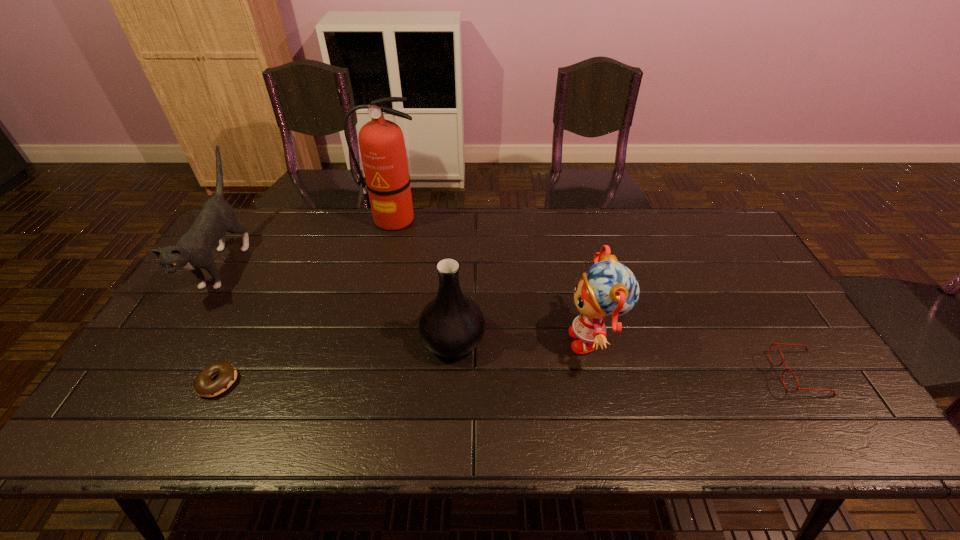
Where is `cat positioned at the far edge`? The width and height of the screenshot is (960, 540). cat positioned at the far edge is located at coordinates (193, 251).

In order to click on object located in the left edge section of the desktop in this screenshot , I will do `click(193, 251)`.

I want to click on object present at the right edge, so click(782, 362).

The height and width of the screenshot is (540, 960). Find the location of `object situated at the far left corner`. object situated at the far left corner is located at coordinates (193, 251).

The image size is (960, 540). What are the coordinates of `vacant space at the far edge of the desktop` in the screenshot? It's located at (497, 223).

Image resolution: width=960 pixels, height=540 pixels. In the image, there is a desktop. In order to click on vacant area at the near edge in this screenshot , I will do [x=180, y=427].

Where is `free location at the left edge`? This screenshot has width=960, height=540. free location at the left edge is located at coordinates (174, 406).

The image size is (960, 540). I want to click on vacant space at the right edge, so click(755, 315).

This screenshot has height=540, width=960. Find the location of `vacant space at the far left corner of the desktop`. vacant space at the far left corner of the desktop is located at coordinates click(x=249, y=228).

You are a GUI agent. You are given a task and a screenshot of the screen. Output one action in this format:
    pyautogui.click(x=<x>, y=<y>)
    Task: Click on the vacant area at the far right corner
    This screenshot has height=540, width=960.
    Given the screenshot: What is the action you would take?
    pyautogui.click(x=729, y=241)